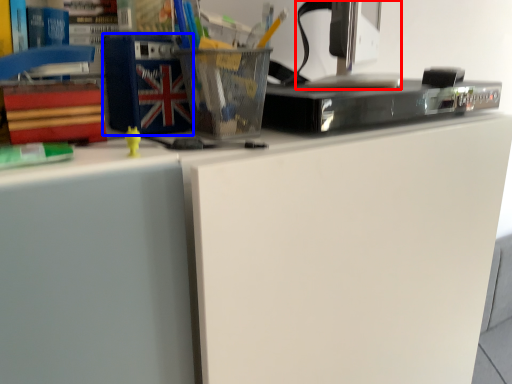
Question: Which of the following is the closest to the observer, desktop computer (highlighted by a red box) or paperback book (highlighted by a blue box)?

Choices:
 (A) desktop computer
 (B) paperback book

Answer: (B)